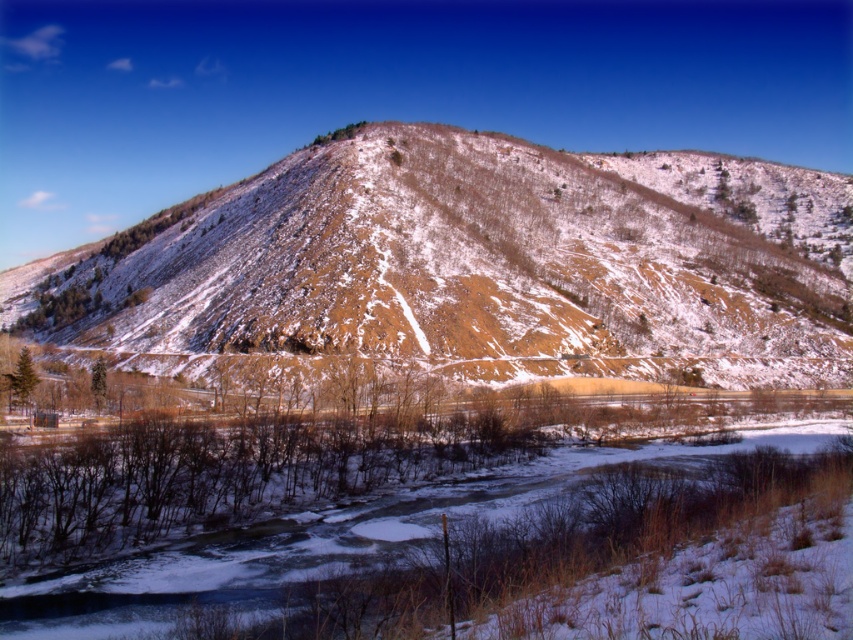
Question: Which point is closer to the camera?

Choices:
 (A) brown textured mountain at center
 (B) white snowy river at lower center

Answer: (B)

Question: Which point is farther from the camera taking this photo?

Choices:
 (A) click(x=775, y=250)
 (B) click(x=642, y=561)

Answer: (A)

Question: Considering the relative positions of brown textured mountain at center and white snowy river at lower center in the image provided, where is brown textured mountain at center located with respect to white snowy river at lower center?

Choices:
 (A) left
 (B) right

Answer: (B)

Question: Is brown textured mountain at center closer to the viewer compared to white snowy river at lower center?

Choices:
 (A) yes
 (B) no

Answer: (B)

Question: Is brown textured mountain at center above white snowy river at lower center?

Choices:
 (A) yes
 (B) no

Answer: (A)